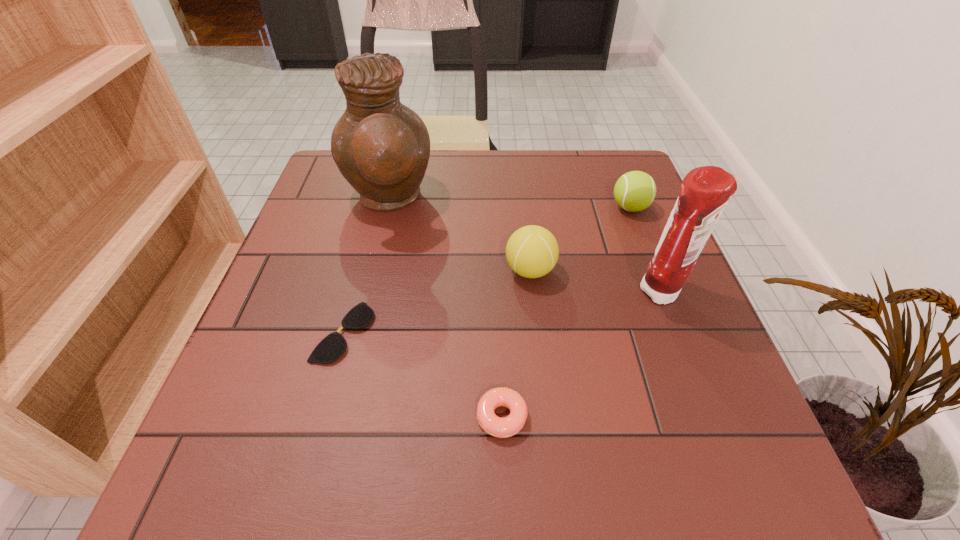
This screenshot has height=540, width=960. In order to click on object positioned at the far right corner in this screenshot , I will do `click(634, 191)`.

In the image, there is a desktop. Find the location of `vacant space at the far edge`. vacant space at the far edge is located at coordinates (568, 172).

This screenshot has width=960, height=540. In the image, there is a desktop. Identify the location of vacant space at the near edge. (573, 447).

Locate an element on the screen. This screenshot has height=540, width=960. vacant position at the left edge of the desktop is located at coordinates (344, 217).

Identify the location of free space at the right edge of the desktop. Image resolution: width=960 pixels, height=540 pixels. (625, 254).

This screenshot has width=960, height=540. Find the location of `free location at the far left corner of the desktop`. free location at the far left corner of the desktop is located at coordinates (333, 181).

The height and width of the screenshot is (540, 960). I want to click on vacant space at the far right corner of the desktop, so click(583, 187).

Find the location of a particular element. vacant space at the near right corner of the desktop is located at coordinates (711, 507).

You are a GUI agent. You are given a task and a screenshot of the screen. Output one action in this format:
    pyautogui.click(x=<x>, y=<y>)
    Task: Click on the vacant space that's between the second shortest object and the pitcher
    The width and height of the screenshot is (960, 540).
    Given the screenshot: What is the action you would take?
    pyautogui.click(x=445, y=308)

Find the location of `unoccupied area between the second shortest object and the left tennis ball`. unoccupied area between the second shortest object and the left tennis ball is located at coordinates (516, 344).